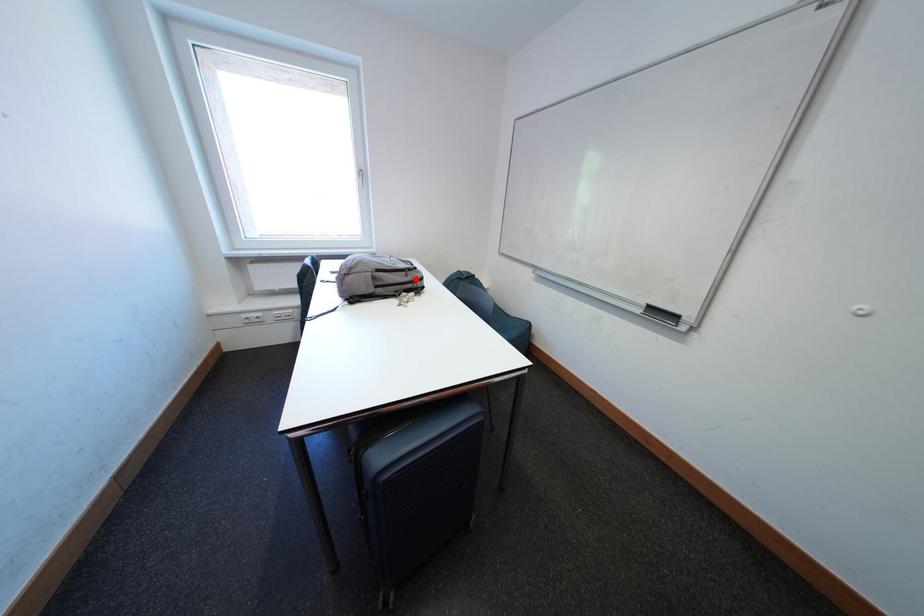
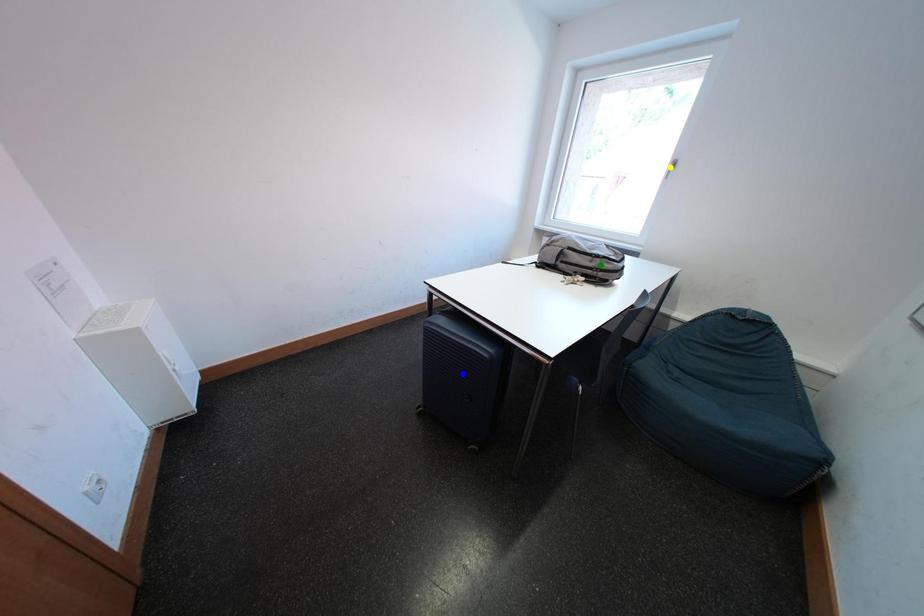
Question: I am providing you with two images of the same scene from different viewpoints. A red point is marked on the first image. You are given multiple points on the second image. Can you choose the point in image 2 that corresponds to the point in image 1?

Choices:
 (A) blue point
 (B) green point
 (C) yellow point

Answer: (B)